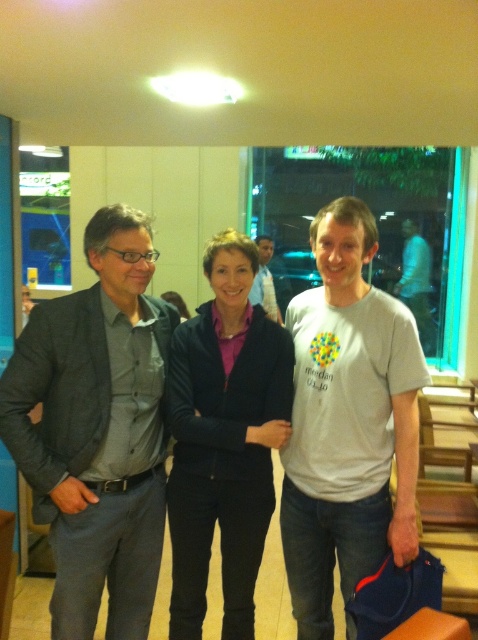
Who is more forward, (67, 513) or (268, 275)?

Point (67, 513) is in front.

Is dark gray textured blazer at left taller than light blue shirt at center?

Yes, dark gray textured blazer at left is taller than light blue shirt at center.

The image size is (478, 640). I want to click on dark gray textured blazer at left, so click(97, 429).

The height and width of the screenshot is (640, 478). I want to click on dark gray textured blazer at left, so click(97, 429).

Can you confirm if dark gray textured blazer at left is positioned above gray cotton t-shirt at center?

Actually, dark gray textured blazer at left is below gray cotton t-shirt at center.

This screenshot has height=640, width=478. What do you see at coordinates (97, 429) in the screenshot?
I see `dark gray textured blazer at left` at bounding box center [97, 429].

Measure the distance between point (10, 451) and camera.

The distance of point (10, 451) from camera is 5.54 feet.

At what (x,y) coordinates should I click in order to perform the action: click on dark gray textured blazer at left. Please return your answer as a coordinate pair (x, y). The image size is (478, 640). Looking at the image, I should click on (97, 429).

Measure the distance between gray cotton t-shirt at center and light blue shirt at center.

The distance of gray cotton t-shirt at center from light blue shirt at center is 10.67 feet.

In the scene shown: Can you confirm if gray cotton t-shirt at center is taller than light blue shirt at center?

Yes.

Which is behind, point (404, 324) or point (258, 243)?

Positioned behind is point (258, 243).

Find the location of a particular element. This screenshot has height=640, width=478. gray cotton t-shirt at center is located at coordinates (347, 422).